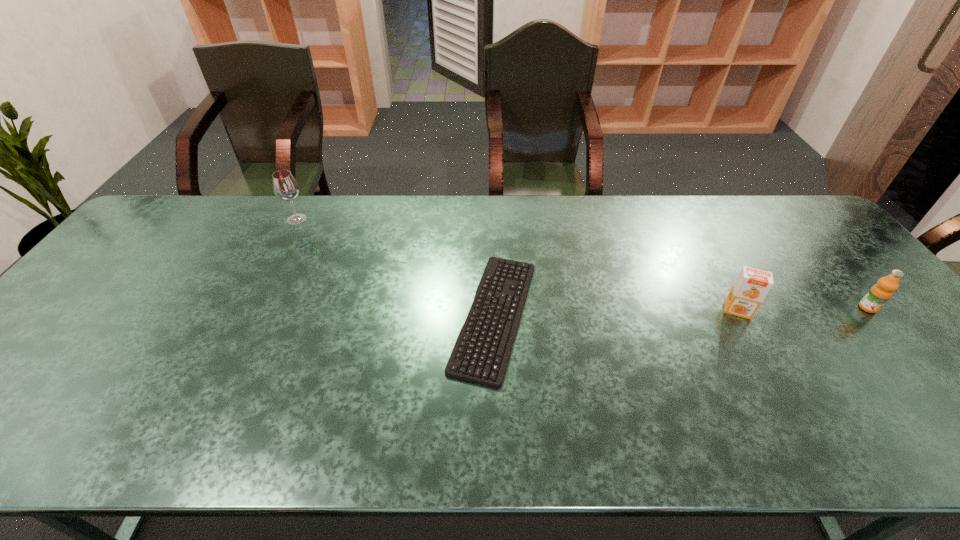
Find the location of `object that is at the far edge`. object that is at the far edge is located at coordinates (285, 187).

At what (x,y) coordinates should I click in order to perform the action: click on object present at the right edge. Please return your answer as a coordinate pair (x, y). Looking at the image, I should click on (880, 293).

In the image, there is a desktop. Where is `free space at the far edge`? free space at the far edge is located at coordinates (543, 198).

In the image, there is a desktop. Find the location of `vacant space at the near edge`. vacant space at the near edge is located at coordinates (619, 415).

Locate an element on the screen. This screenshot has height=540, width=960. free space at the left edge of the desktop is located at coordinates (40, 344).

You are a GUI agent. You are given a task and a screenshot of the screen. Output one action in this format:
    pyautogui.click(x=<x>, y=<y>)
    Task: Click on the vacant region between the right orange juice and the wineglass
    This screenshot has height=540, width=960.
    Given the screenshot: What is the action you would take?
    pyautogui.click(x=583, y=264)

The image size is (960, 540). What are the coordinates of `free point between the shortest object and the rightmost object` in the screenshot? It's located at (681, 312).

What are the coordinates of `free spot between the rightmost object and the computer keyboard` in the screenshot? It's located at (681, 312).

Where is `free space between the second object from right to left and the right orange juice`? The width and height of the screenshot is (960, 540). free space between the second object from right to left and the right orange juice is located at coordinates (803, 309).

Locate an element on the screen. empty location between the computer keyboard and the leftmost object is located at coordinates (396, 267).